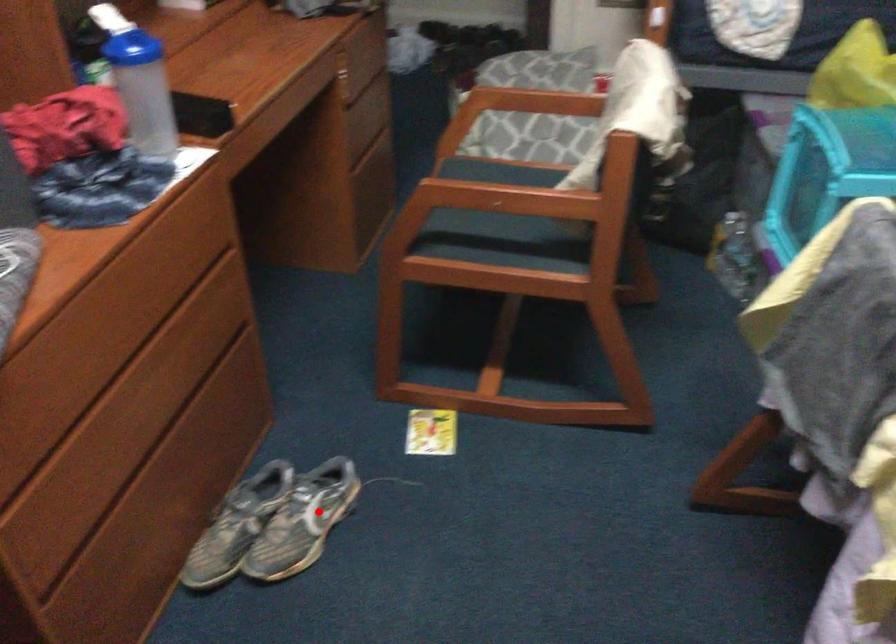
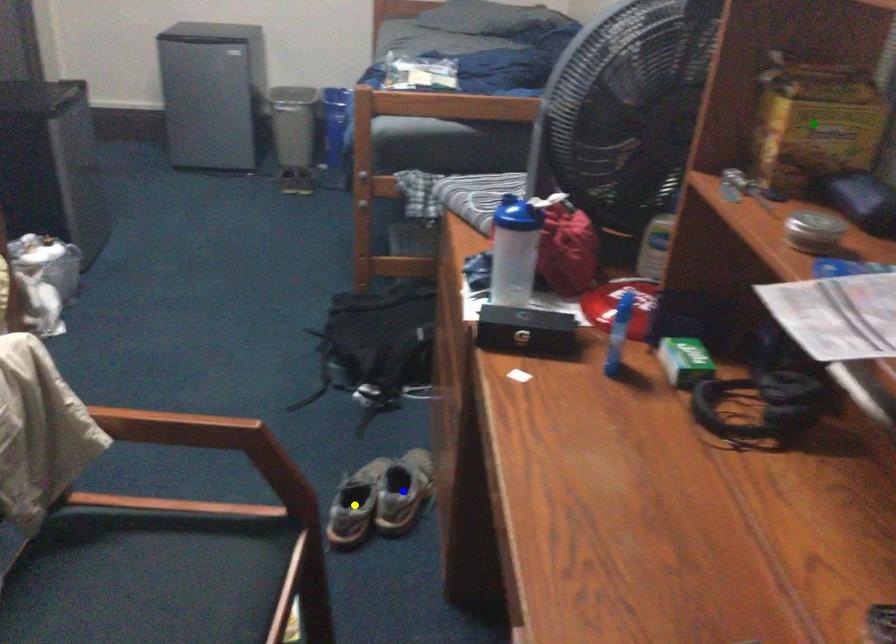
Question: I am providing you with two images of the same scene from different viewpoints. A red point is marked on the first image. You are given multiple points on the second image. Which mark in image 2 goes with the point in image 1?

Choices:
 (A) yellow point
 (B) green point
 (C) blue point

Answer: (A)